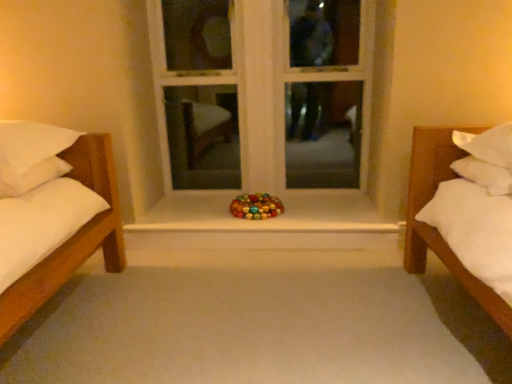
Where is `free space above smooth white surface at center (from a real-world perspective)`? free space above smooth white surface at center (from a real-world perspective) is located at coordinates (253, 218).